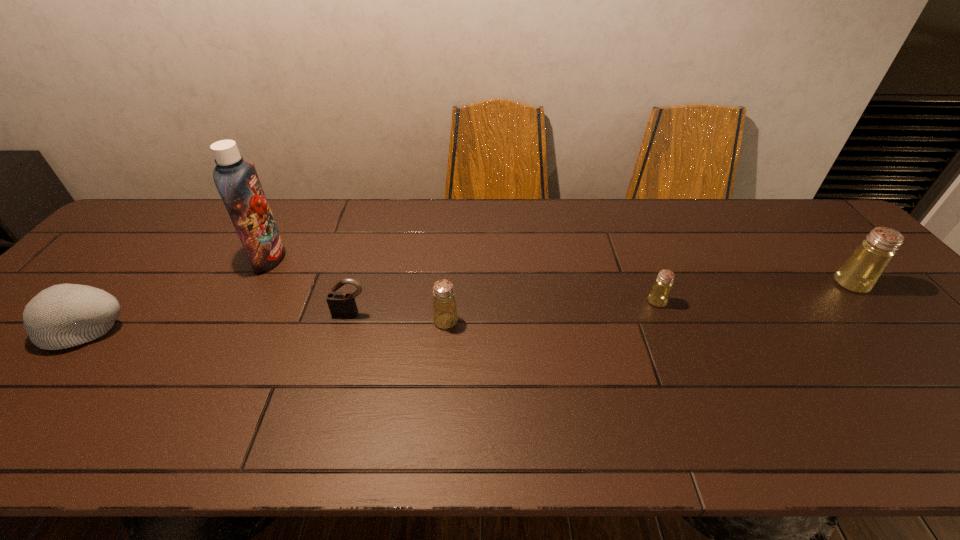
Please point a spot to add another saltshaker on the left. Please provide its 2D coordinates. Your answer should be formatted as a tuple, i.e. [(x, y)], where the tuple contains the x and y coordinates of a point satisfying the conditions above.

[(215, 342)]